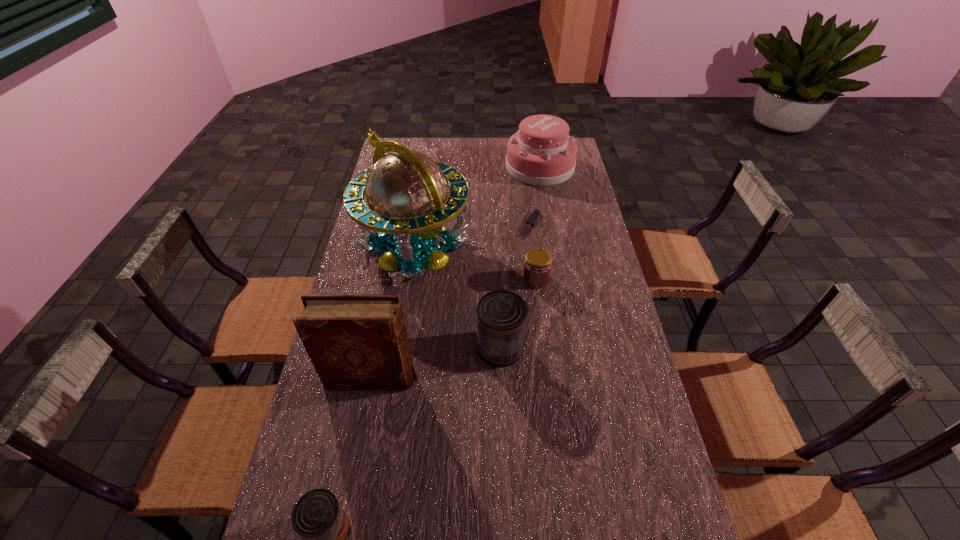
You are a GUI agent. You are given a task and a screenshot of the screen. Output one action in this format:
    pyautogui.click(x=<x>, y=<y>)
    Task: Click on the free spot between the globe and the steak knife
    This screenshot has height=540, width=960.
    Given the screenshot: What is the action you would take?
    pyautogui.click(x=472, y=235)

Find the location of a particular element. The image size is (960, 540). vacant area between the steak knife and the taller can is located at coordinates (515, 286).

This screenshot has width=960, height=540. Identify the location of vacant space that is in between the hardback book and the shortest object. (450, 301).

Select which object appears as the fourth closest to the jam. Please provide its 2D coordinates. Your answer should be formatted as a tuple, i.e. [(x, y)], where the tuple contains the x and y coordinates of a point satisfying the conditions above.

[(355, 342)]

Identify which object is the second closest to the tallest object. Please provide its 2D coordinates. Your answer should be formatted as a tuple, i.e. [(x, y)], where the tuple contains the x and y coordinates of a point satisfying the conditions above.

[(536, 212)]

The height and width of the screenshot is (540, 960). Identify the location of free space that satisfies the following two spatial constraints: 1. on the front side of the taller can; 2. on the right side of the globe. (399, 348).

Where is `free point that satisfies the following two spatial constraints: 1. on the back side of the right can; 2. on the left side of the farthest object`? Image resolution: width=960 pixels, height=540 pixels. free point that satisfies the following two spatial constraints: 1. on the back side of the right can; 2. on the left side of the farthest object is located at coordinates (493, 167).

What are the coordinates of `free spot that satisfies the following two spatial constraints: 1. on the front side of the jam; 2. on the spine side of the hardback book` in the screenshot? It's located at click(x=548, y=378).

Where is `vacant area in the image that satisfies the following two spatial constraints: 1. on the front side of the shortest object; 2. on the spine side of the hardback book`? vacant area in the image that satisfies the following two spatial constraints: 1. on the front side of the shortest object; 2. on the spine side of the hardback book is located at coordinates (548, 378).